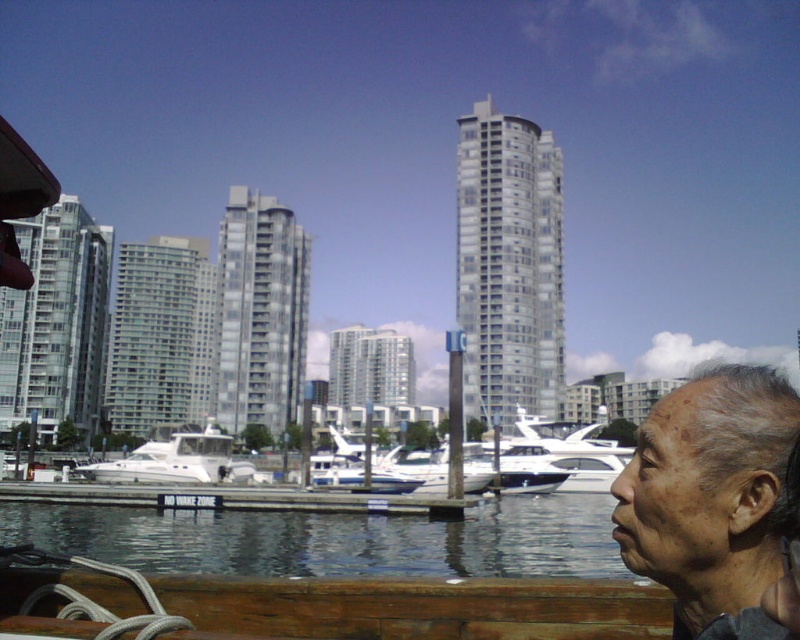
Question: Which object is the closest to the gray hair at lower right?

Choices:
 (A) white wood dock at lower center
 (B) clear water at lower left
 (C) white glossy boat at center

Answer: (B)

Question: Which is nearer to the gray hair at lower right?

Choices:
 (A) white wood dock at lower center
 (B) white glossy boat at center
 (C) clear water at lower left

Answer: (C)

Question: Which is nearer to the white glossy boat at center?

Choices:
 (A) white wood dock at lower center
 (B) clear water at lower left
 (C) gray hair at lower right

Answer: (A)

Question: Is clear water at lower left thinner than white glossy boat at center?

Choices:
 (A) yes
 (B) no

Answer: (B)

Question: Does white wood dock at lower center appear over white glossy boat at center?

Choices:
 (A) yes
 (B) no

Answer: (A)

Question: Can you confirm if clear water at lower left is smaller than gray hair at lower right?

Choices:
 (A) yes
 (B) no

Answer: (B)